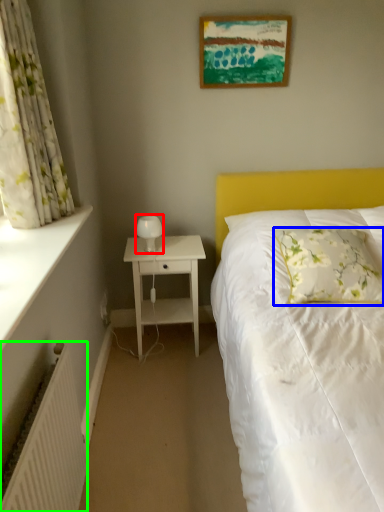
Question: Which object is the farthest from bedside lamp (highlighted by a red box)? Choose among these: pillow (highlighted by a blue box) or radiator (highlighted by a green box).

Choices:
 (A) pillow
 (B) radiator

Answer: (B)